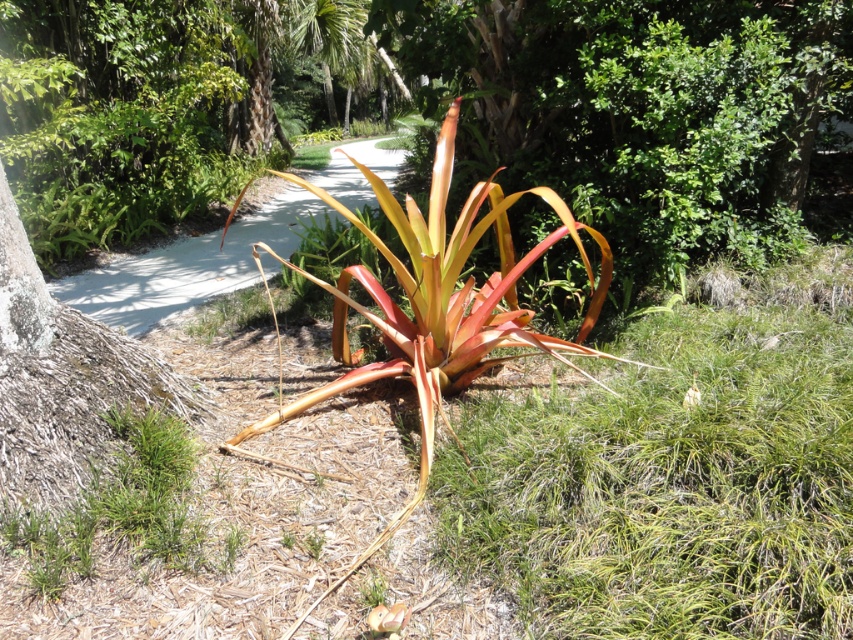
You are a gardener who wants to water the white fluffy flower at center without getting the matte orange leaf at center wet. Which direction should you aim the hose?

The matte orange leaf at center is positioned under the white fluffy flower at center, so you should aim the hose upwards to water the white fluffy flower at center while avoiding the matte orange leaf at center below it.

You are standing at the point labeled point (335, 161) and want to walk to the bromeliad plant. The pathway is 1.2 meters wide. Can you walk directly to the plant without stepping off the pathway?

The distance between you and the bromeliad plant is 14.65 meters. Since the pathway is 1.2 meters wide, you can walk directly to the plant without stepping off the pathway as long as the path is wide enough to accommodate your movement. However, the question does not provide information about the path width relative to your position. The answer cannot be determined with the given data.